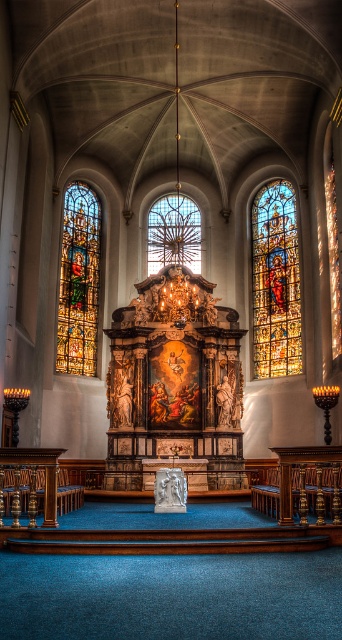
Question: Which object is the farthest from the clear stained glass at center?

Choices:
 (A) stained glass window at left
 (B) stained glass window at right

Answer: (B)

Question: Can you confirm if stained glass window at left is wider than clear stained glass at center?

Choices:
 (A) no
 (B) yes

Answer: (A)

Question: Which point is farther from the camera taking this photo?

Choices:
 (A) (68, 188)
 (B) (163, 209)

Answer: (B)

Question: Which point is closer to the camera?

Choices:
 (A) (177, 244)
 (B) (79, 332)
 (C) (295, 317)

Answer: (C)

Question: Is stained glass window at right to the right of clear stained glass at center from the viewer's perspective?

Choices:
 (A) yes
 (B) no

Answer: (A)

Question: Considering the relative positions of stained glass window at right and stained glass window at left in the image provided, where is stained glass window at right located with respect to stained glass window at left?

Choices:
 (A) right
 (B) left

Answer: (A)